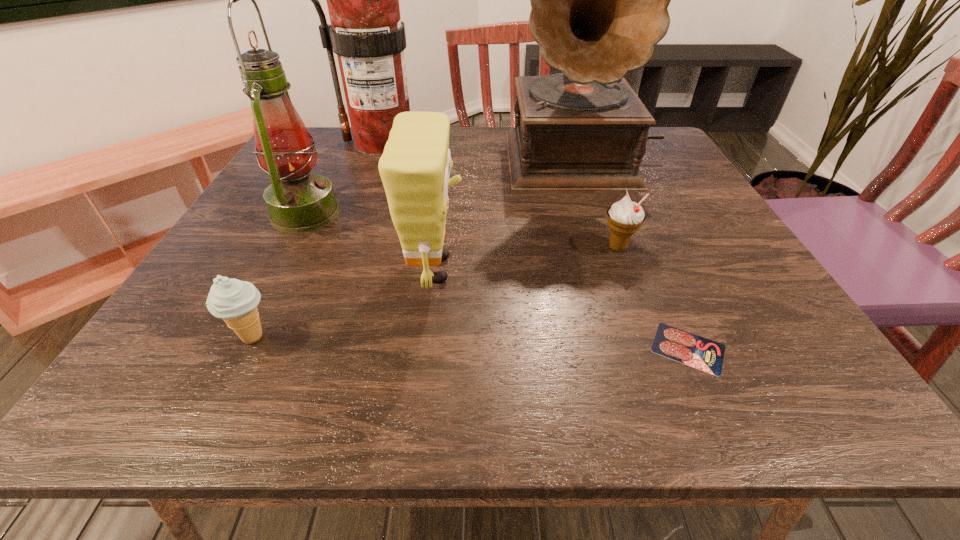
This screenshot has width=960, height=540. What are the coordinates of `fire extinguisher` in the screenshot? It's located at (366, 32).

Locate an element on the screen. Image resolution: width=960 pixels, height=540 pixels. record player is located at coordinates (599, 0).

I want to click on the third tallest object, so click(298, 201).

Locate an element on the screen. sponge is located at coordinates (415, 166).

Find the location of `the right icecream`. the right icecream is located at coordinates (625, 217).

You are a GUI agent. You are given a task and a screenshot of the screen. Output one action in this format:
    pyautogui.click(x=<x>, y=<y>)
    Task: Click on the nearer icecream
    The image size is (960, 540).
    Given the screenshot: What is the action you would take?
    pyautogui.click(x=235, y=301)

You are a GUI agent. You are given a task and a screenshot of the screen. Output one action in this format:
    pyautogui.click(x=<x>, y=<y>)
    Task: Click on the shortest object
    
    Given the screenshot: What is the action you would take?
    pyautogui.click(x=701, y=353)

Find the location of a particular element. free space located 0.380m at the nozzle of the fire extinguisher is located at coordinates (584, 143).

Identify the location of vacant space located from the horn of the record player. The width and height of the screenshot is (960, 540). (631, 289).

The width and height of the screenshot is (960, 540). Find the location of `free region located 0.130m on the right of the fifth shortest object`. free region located 0.130m on the right of the fifth shortest object is located at coordinates tap(400, 213).